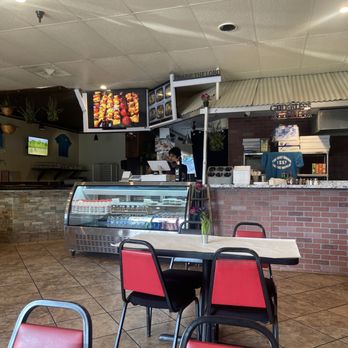
Where is `chairs`? This screenshot has height=348, width=348. chairs is located at coordinates (233, 277), (140, 274), (44, 335), (196, 343), (244, 233), (190, 229).